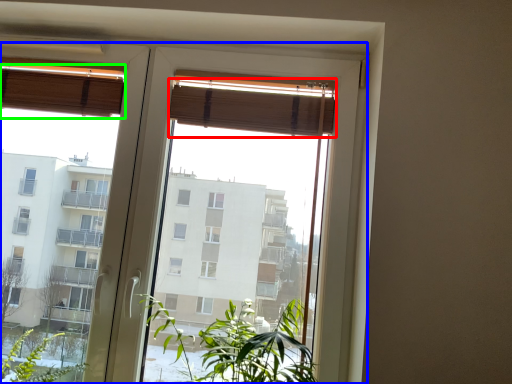
Question: Based on their relative distances, which object is nearer to curtain (highlighted by a red box)? Choose from window (highlighted by a blue box) and curtain (highlighted by a green box).

Choices:
 (A) window
 (B) curtain

Answer: (A)